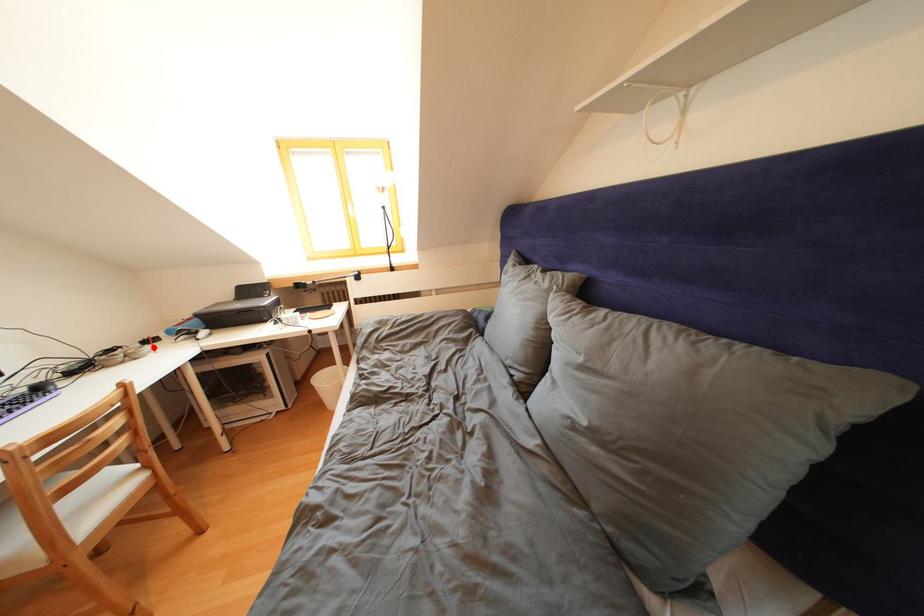
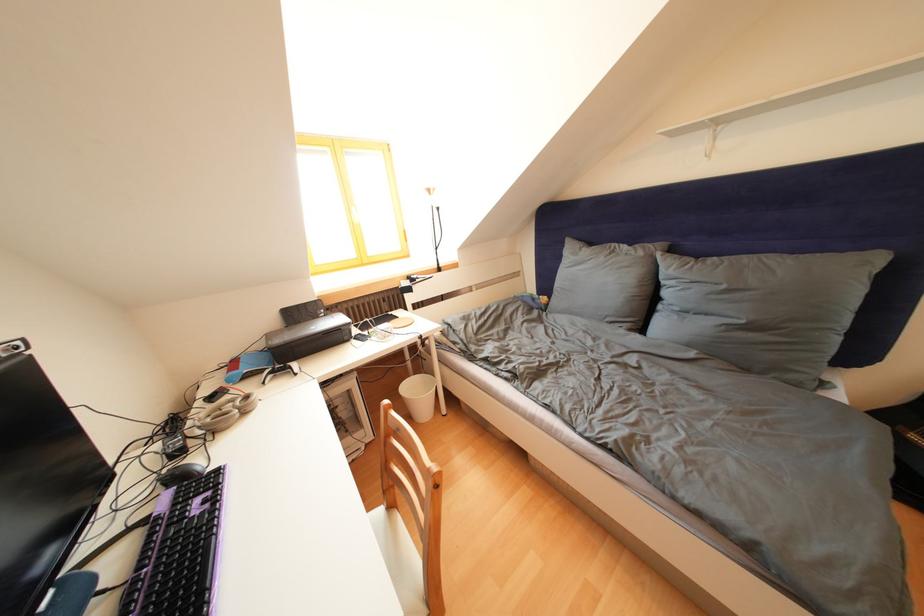
The point at the highlighted location is marked in the first image. Where is the corresponding point in the second image?

(220, 403)